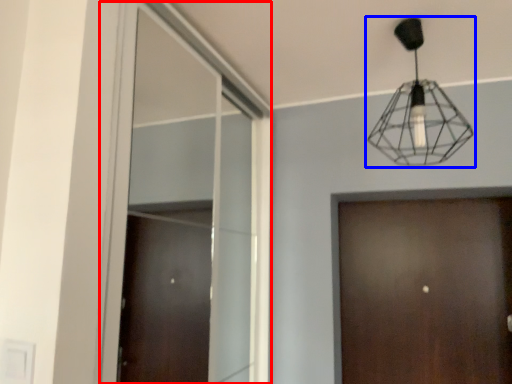
Question: Among these objects, which one is nearest to the camera, window (highlighted by a red box) or lamp (highlighted by a blue box)?

Choices:
 (A) window
 (B) lamp

Answer: (A)